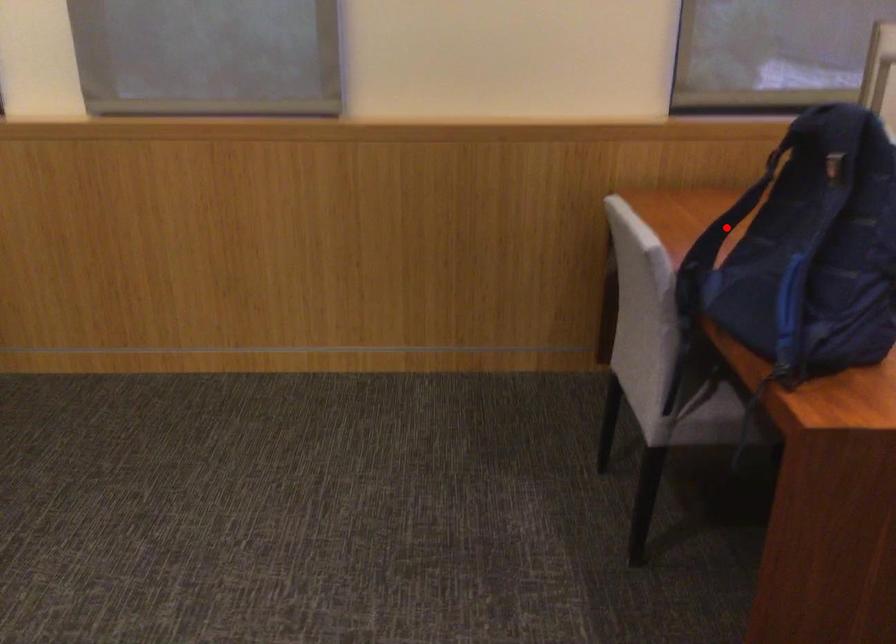
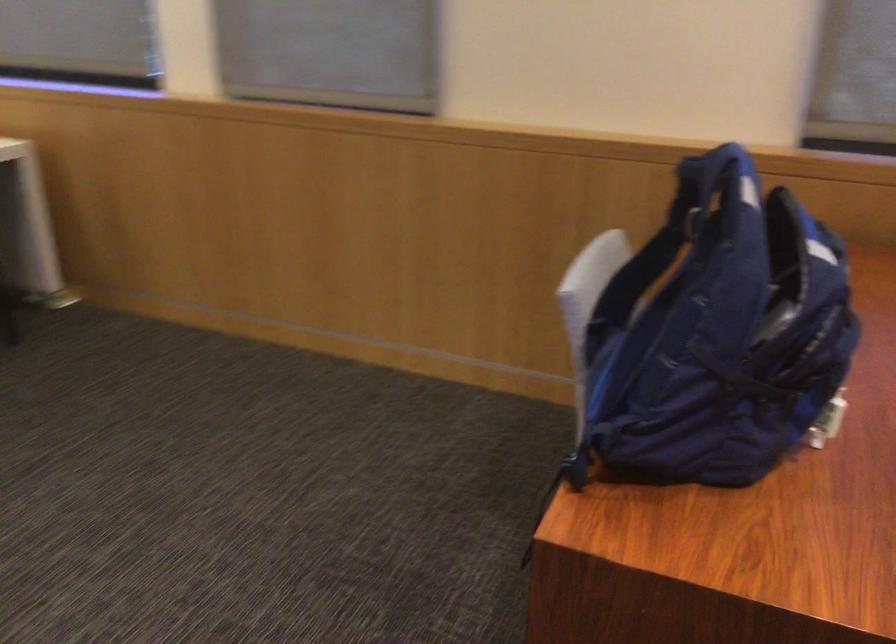
Question: I am providing you with two images of the same scene from different viewpoints. Given a red point in image1, look at the same physical point in image2. Is it:

Choices:
 (A) Closer to the viewpoint
 (B) Farther from the viewpoint

Answer: (A)